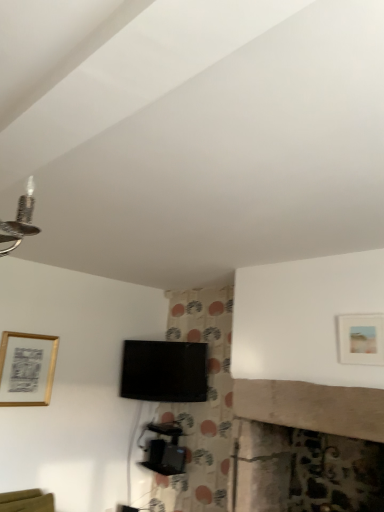
Question: From the image's perspective, is gold metallic picture frame at upper left, the 2th picture frame in the top-to-bottom sequence, located above or below matte gold picture frame at upper right, acting as the 2th picture frame starting from the bottom?

Choices:
 (A) above
 (B) below

Answer: (B)

Question: Considering their positions, is gold metallic picture frame at upper left, the second picture frame in the front-to-back sequence, located in front of or behind matte gold picture frame at upper right, which appears as the 2th picture frame when viewed from the back?

Choices:
 (A) front
 (B) behind

Answer: (B)

Question: Which of these objects is positioned closest to the matte gold picture frame at upper right, which appears as the first picture frame when viewed from the front?

Choices:
 (A) gold metallic picture frame at upper left, marked as the 1th picture frame in a left-to-right arrangement
 (B) black plastic tv stand at center
 (C) black glossy tv at center

Answer: (C)

Question: Based on their relative distances, which object is nearer to the black plastic tv stand at center?

Choices:
 (A) gold metallic picture frame at upper left, which is the second picture frame in right-to-left order
 (B) matte gold picture frame at upper right, acting as the 2th picture frame starting from the bottom
 (C) black glossy tv at center

Answer: (C)